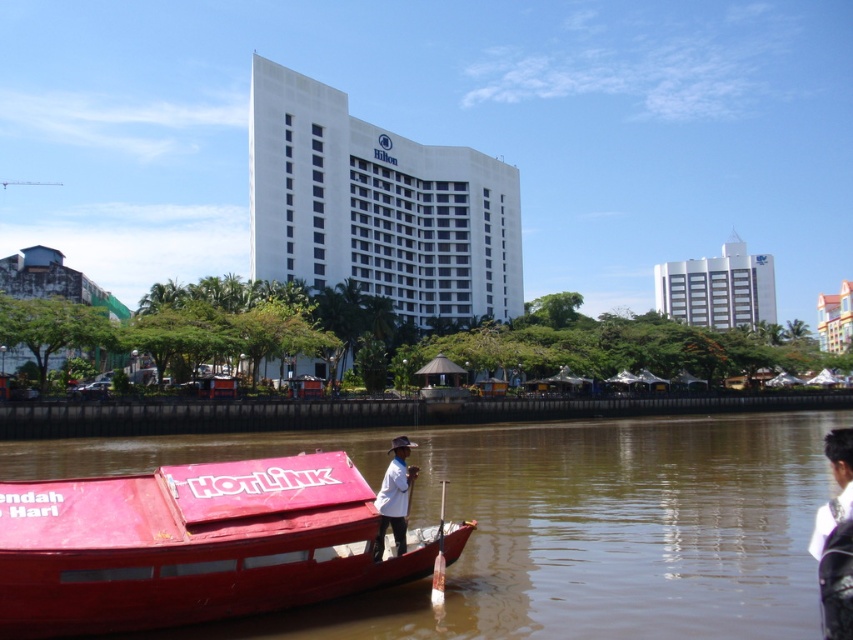
Question: Is red matte boat at lower left above white fabric shirt at lower right?

Choices:
 (A) yes
 (B) no

Answer: (B)

Question: Which point is closer to the camera?

Choices:
 (A) brown matte river at lower center
 (B) white matte shirt at center
 (C) red matte boat at lower left
 (D) white fabric shirt at lower right

Answer: (D)

Question: Which object is positioned farthest from the red matte boat at lower left?

Choices:
 (A) brown matte river at lower center
 (B) white matte shirt at center
 (C) wooden paddle at lower center
 (D) white fabric shirt at lower right

Answer: (D)

Question: Estimate the real-world distances between objects in this image. Which object is closer to the brown matte river at lower center?

Choices:
 (A) red matte boat at lower left
 (B) white matte shirt at center

Answer: (A)

Question: Is brown matte river at lower center closer to the viewer compared to wooden paddle at lower center?

Choices:
 (A) no
 (B) yes

Answer: (B)

Question: Is red matte boat at lower left to the left of white matte shirt at center from the viewer's perspective?

Choices:
 (A) no
 (B) yes

Answer: (B)